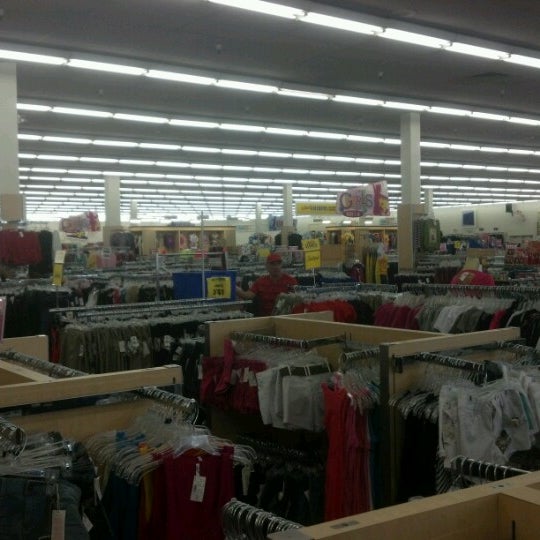
Locate an element on the screen. The height and width of the screenshot is (540, 540). columns is located at coordinates [12, 129], [110, 199], [135, 211], [258, 211], [287, 205], [413, 164], [430, 200].